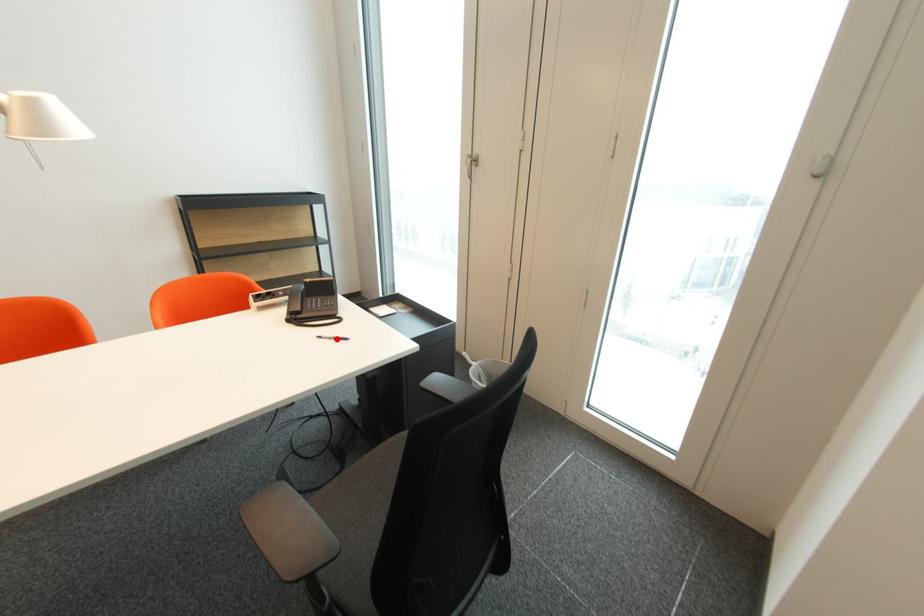
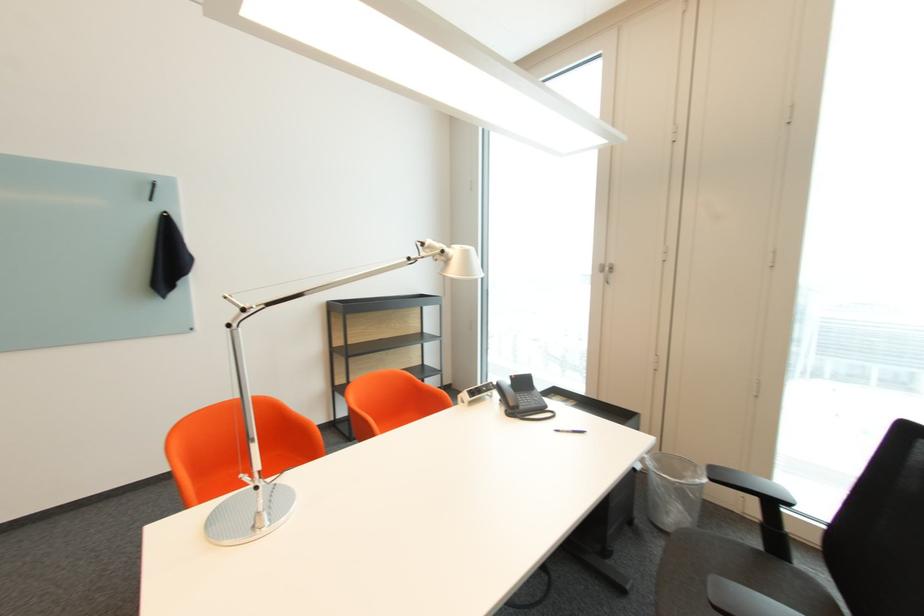
Find the pixel in the second image that matches the highlighted location in the first image.

(574, 432)